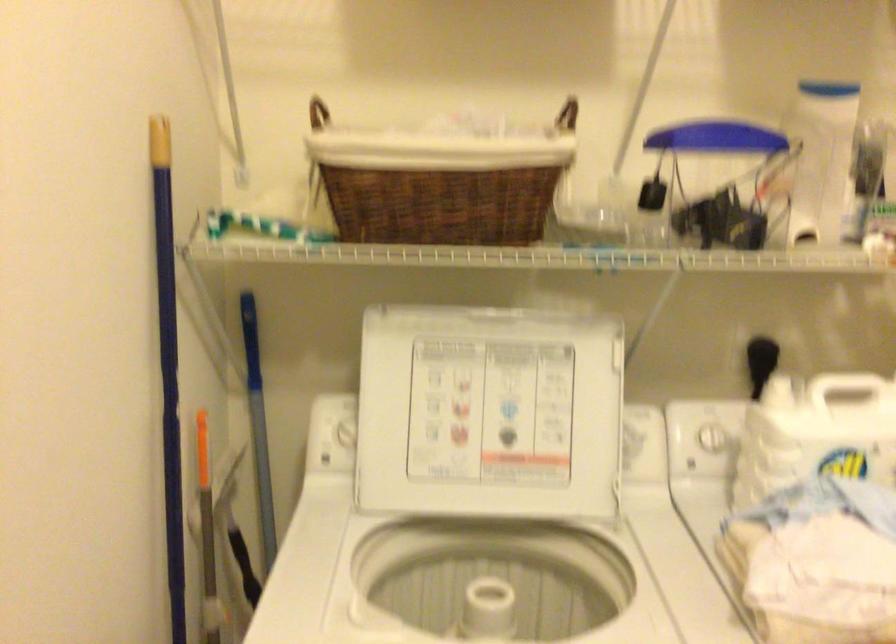
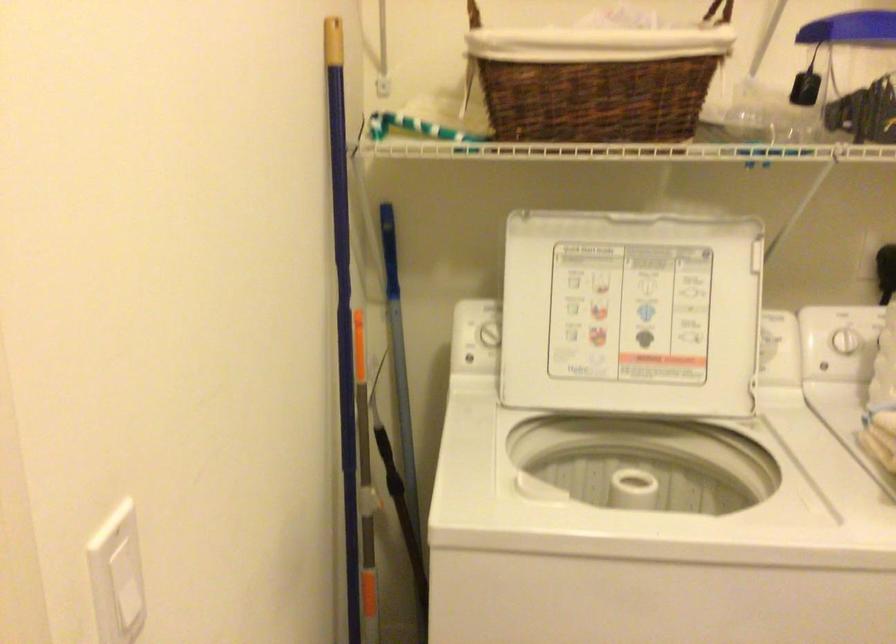
Question: How did the camera likely rotate?

Choices:
 (A) Left
 (B) Right
 (C) Up
 (D) Down

Answer: (A)